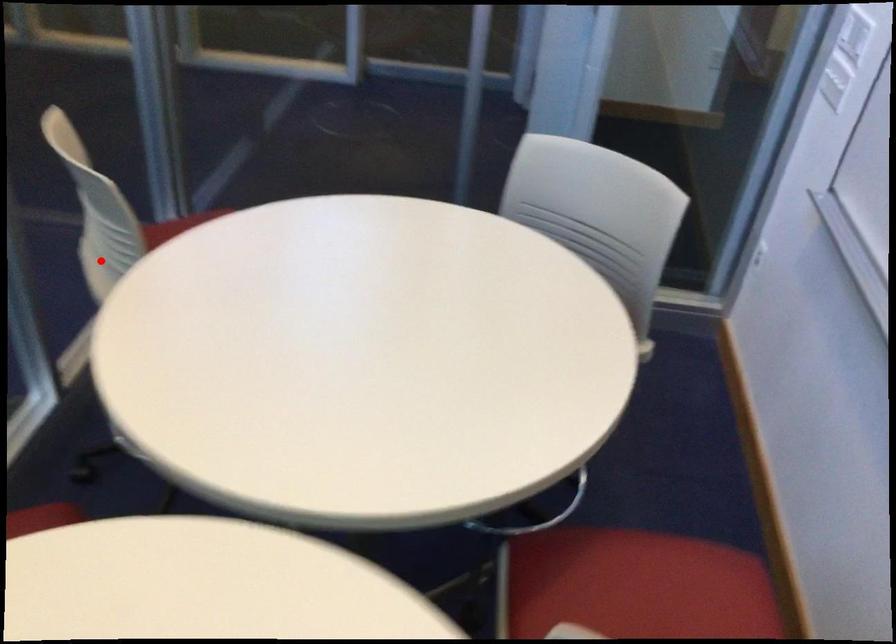
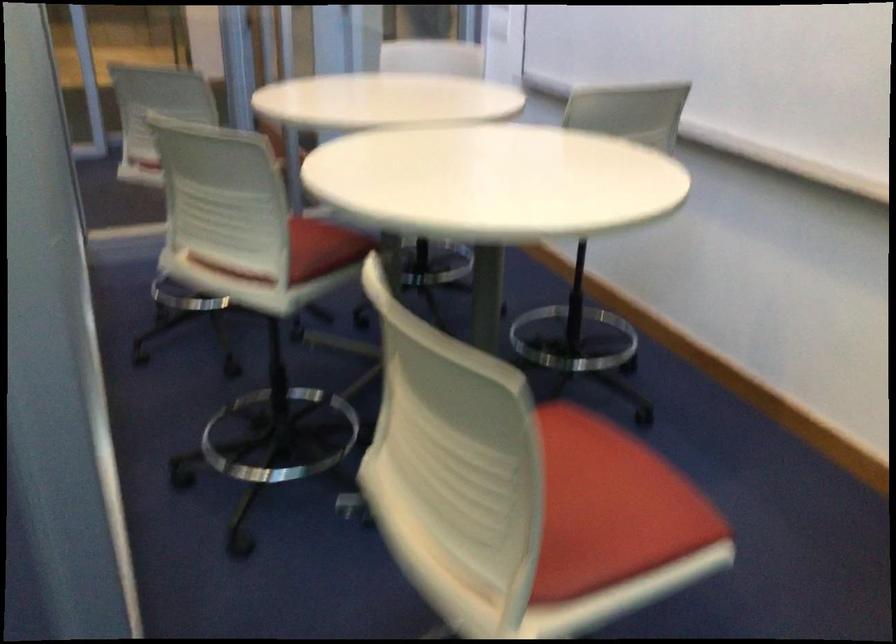
Find the pixel in the second image that matches the highlighted location in the first image.

(149, 166)